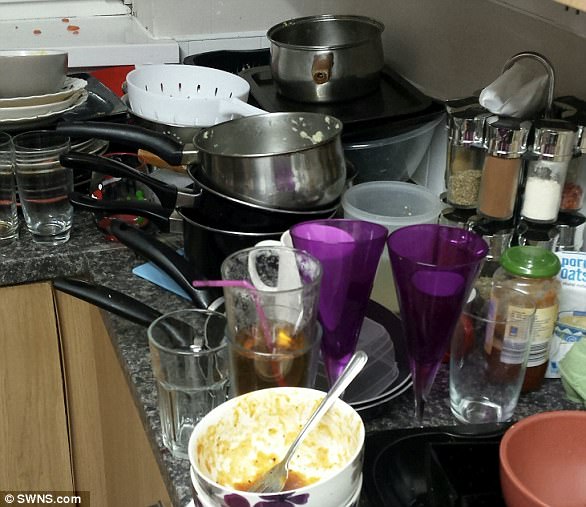
Where is `kitchen tan cabinets`? This screenshot has height=507, width=586. kitchen tan cabinets is located at coordinates (66, 393), (27, 405).